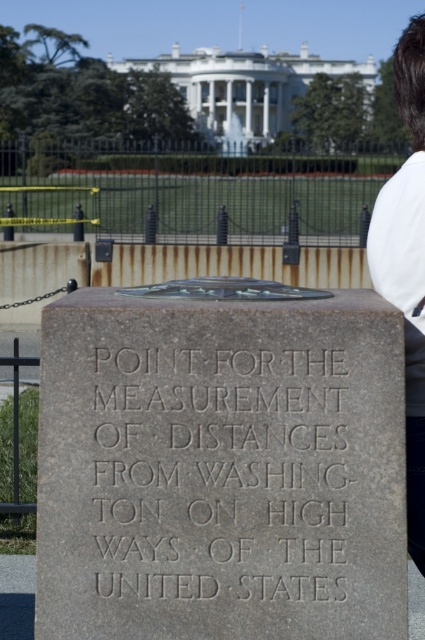
Is gray stone engraving at center closer to the viewer compared to white fabric shirt at upper right?

No, gray stone engraving at center is behind white fabric shirt at upper right.

In the scene shown: Does gray stone engraving at center have a lesser width compared to white fabric shirt at upper right?

In fact, gray stone engraving at center might be wider than white fabric shirt at upper right.

Between point (150, 513) and point (410, 227), which one is positioned behind?

Point (410, 227)

Find the location of a particular element. The width and height of the screenshot is (425, 640). gray stone engraving at center is located at coordinates (226, 458).